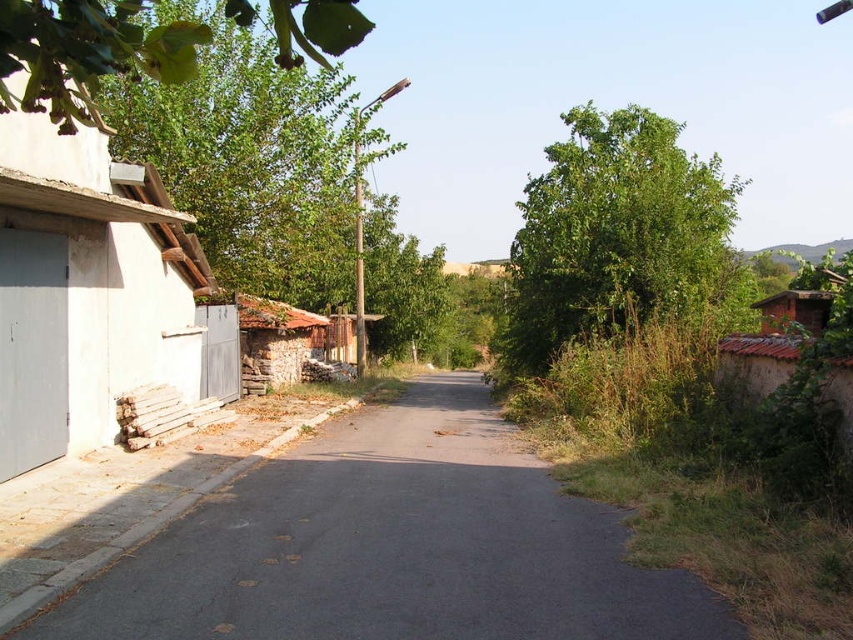
Is asphalt at center shorter than rustic stone hut at center-left?

Correct, asphalt at center is not as tall as rustic stone hut at center-left.

Who is more distant from viewer, (x=432, y=618) or (x=248, y=340)?

The point (x=248, y=340) is more distant.

Does point (508, 435) come farther from viewer compared to point (308, 353)?

That is False.

At what (x,y) coordinates should I click in order to perform the action: click on asphalt at center. Please return your answer as a coordinate pair (x, y). Looking at the image, I should click on (393, 547).

Can you confirm if white concrete hut at left is smaller than green leafy tree at upper left?

Actually, white concrete hut at left might be larger than green leafy tree at upper left.

Which is behind, point (84, 282) or point (19, 42)?

The point (84, 282) is behind.

Is point (25, 268) closer to viewer compared to point (41, 49)?

No, it is behind (41, 49).

You are a GUI agent. You are given a task and a screenshot of the screen. Output one action in this format:
    pyautogui.click(x=<x>, y=<y>)
    Task: Click on the white concrete hut at left
    The image size is (853, 640).
    Given the screenshot: What is the action you would take?
    pyautogui.click(x=86, y=291)

Does asphalt at center lie in front of white concrete hut at left?

Yes, it is.

Does asphalt at center appear over white concrete hut at left?

No, asphalt at center is not above white concrete hut at left.

Identify the location of asphalt at center. (393, 547).